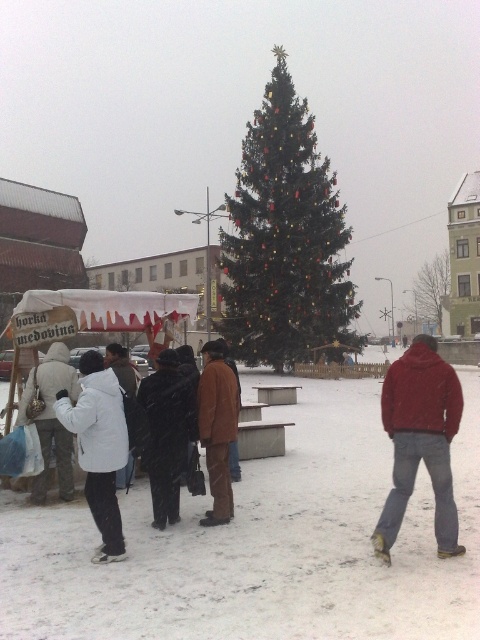
You are standing at the edge of the snowy area and want to reach the hot honey stall. You have a small robot that is 1.5 meters wide. Can your robot move through the path between the red matte jacket at lower right and the black wool coat at center?

The path between the red matte jacket at lower right and the black wool coat at center is 2.09 meters. Since the robot is 1.5 meters wide, it can easily pass through this space as the distance is sufficient.

You are standing in the snowy area and want to go to the white matte jacket at left. Which direction should you move relative to the green matte christmas tree at center?

You should move to the left of the green matte christmas tree at center because the white matte jacket at left is located to the left of the tree.

You are standing in the snowy area and want to take a photo of the green matte christmas tree at center and the white matte jacket at left. Which object should you zoom in on to ensure both are fully captured in the frame without cropping?

Since the green matte christmas tree at center is wider than the white matte jacket at left, you should zoom in on the green matte christmas tree at center to ensure both are fully captured without cropping.